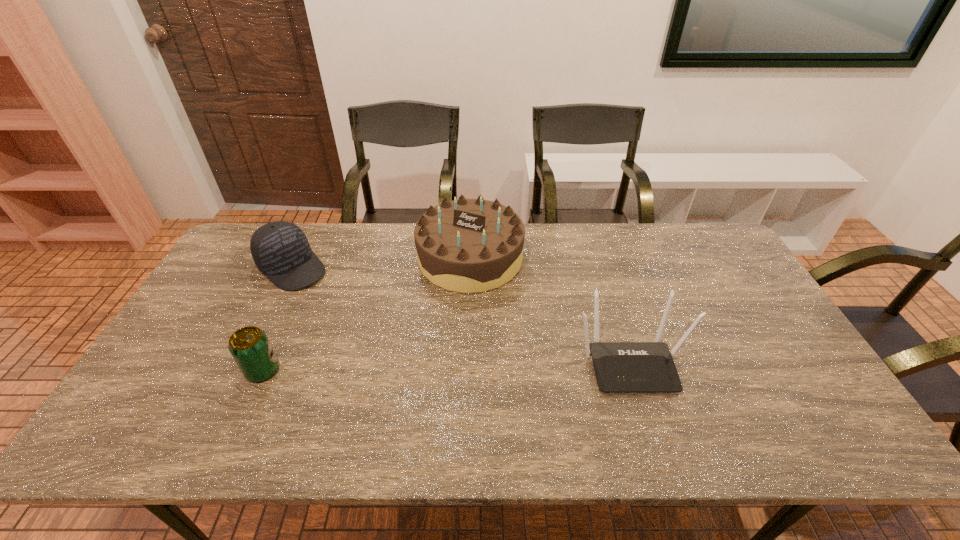
I want to click on free space at the right edge, so click(x=782, y=335).

Image resolution: width=960 pixels, height=540 pixels. I want to click on vacant space at the near left corner, so click(144, 385).

Find the location of a particular element. This screenshot has width=960, height=540. vacant space at the near right corner of the desktop is located at coordinates (780, 386).

Where is `free spot between the beer can and the rightmost object`? The image size is (960, 540). free spot between the beer can and the rightmost object is located at coordinates (446, 367).

Locate an element on the screen. vacant space that is in between the baseball cap and the router is located at coordinates (461, 315).

Where is `free space between the third object from left to right and the baseball cap`? This screenshot has width=960, height=540. free space between the third object from left to right and the baseball cap is located at coordinates (381, 263).

Where is `vacant area that lies between the second object from right to left and the baseball cap`? The height and width of the screenshot is (540, 960). vacant area that lies between the second object from right to left and the baseball cap is located at coordinates (381, 263).

At what (x,y) coordinates should I click in order to perform the action: click on vacant area between the router and the beer can. Please return your answer as a coordinate pair (x, y). Looking at the image, I should click on (446, 367).

At what (x,y) coordinates should I click in order to perform the action: click on vacant space in between the beer can and the second object from right to left. Please return your answer as a coordinate pair (x, y). This screenshot has width=960, height=540. Looking at the image, I should click on (367, 314).

This screenshot has height=540, width=960. I want to click on vacant area that lies between the rightmost object and the beer can, so click(x=446, y=367).